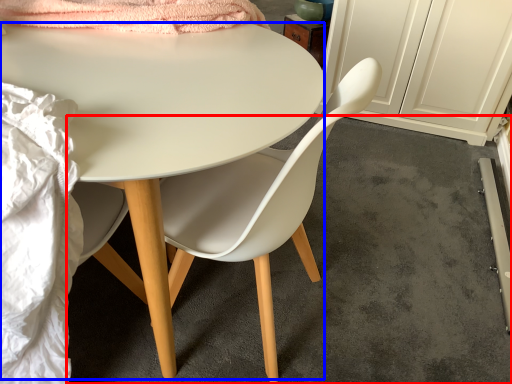
Question: Which point is further to the camera, concrete (highlighted by a red box) or desk (highlighted by a blue box)?

Choices:
 (A) concrete
 (B) desk

Answer: (A)